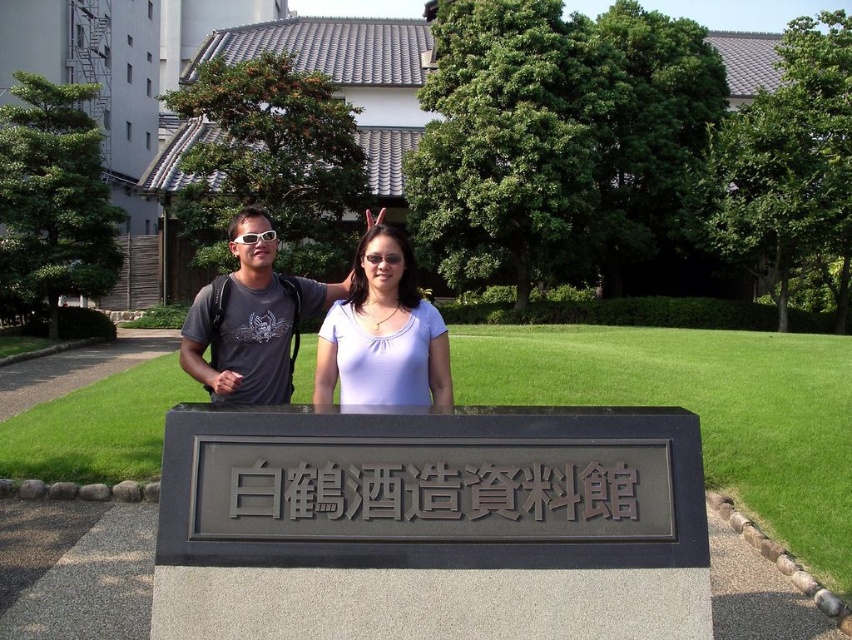
Who is positioned more to the right, black metal sign at center or matte black t-shirt at center?

Positioned to the right is black metal sign at center.

Does black metal sign at center have a smaller size compared to matte black t-shirt at center?

Actually, black metal sign at center might be larger than matte black t-shirt at center.

Who is more forward, (551,468) or (285,307)?

Point (551,468) is in front.

Where is `black metal sign at center`? black metal sign at center is located at coordinates (433, 490).

Between purple matte shirt at center and matte black t-shirt at center, which one is positioned lower?

purple matte shirt at center is below.

Can you confirm if purple matte shirt at center is positioned to the left of matte black t-shirt at center?

No, purple matte shirt at center is not to the left of matte black t-shirt at center.

What do you see at coordinates (383, 333) in the screenshot? Image resolution: width=852 pixels, height=640 pixels. I see `purple matte shirt at center` at bounding box center [383, 333].

The image size is (852, 640). What are the coordinates of `purple matte shirt at center` in the screenshot? It's located at (383, 333).

Does black metal sign at center appear on the left side of purple matte shirt at center?

No, black metal sign at center is not to the left of purple matte shirt at center.

Between black metal sign at center and purple matte shirt at center, which one appears on the left side from the viewer's perspective?

purple matte shirt at center

Between point (432, 515) and point (361, 380), which one is positioned in front?

Positioned in front is point (432, 515).

Locate an element on the screen. black metal sign at center is located at coordinates (433, 490).